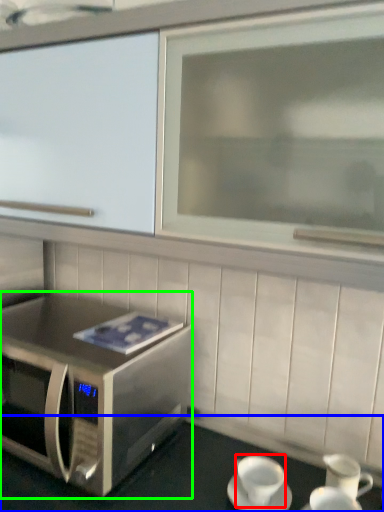
Question: Estimate the real-world distances between objects in this image. Which object is farther from coffee cup (highlighted by a red box), table (highlighted by a blue box) or microwave oven (highlighted by a green box)?

Choices:
 (A) table
 (B) microwave oven

Answer: (B)